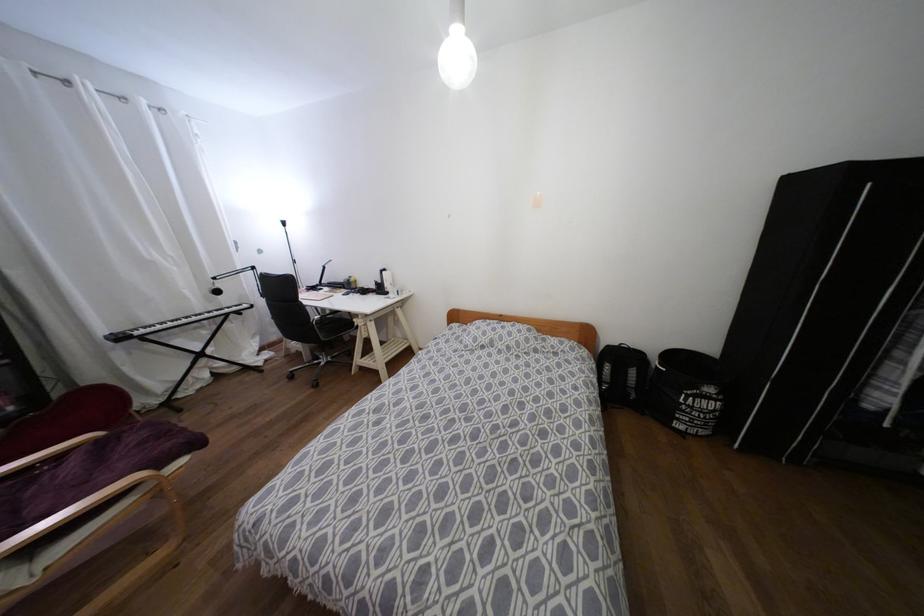
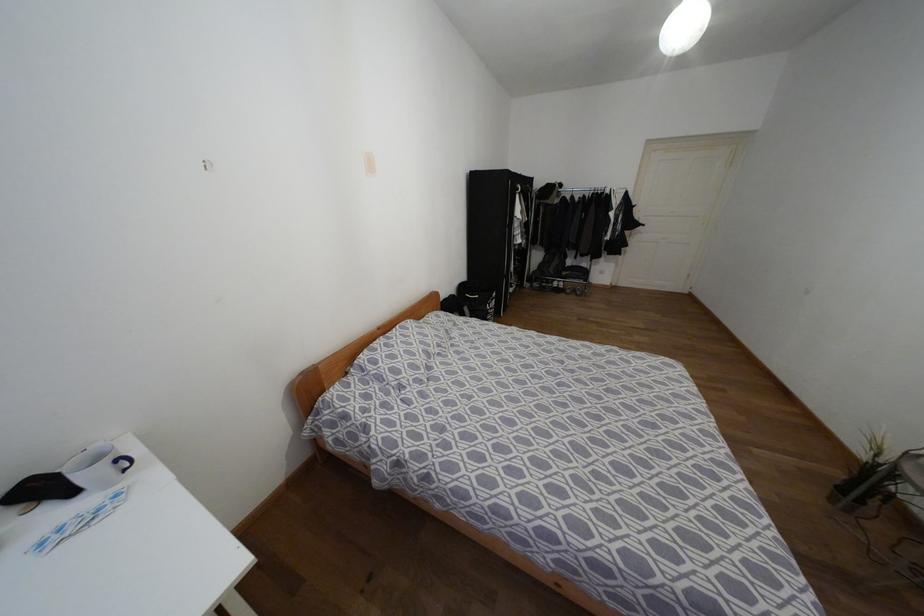
The point at [709,389] is marked in the first image. Where is the corresponding point in the second image?

(493, 294)